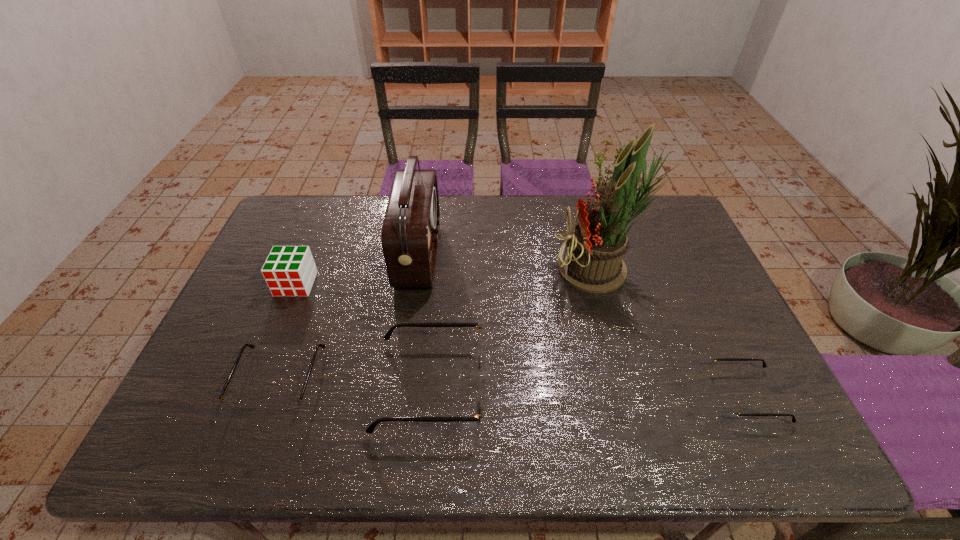
In order to click on vacant region located 0.090m at the hinge ends of the third shortest object in this screenshot , I will do `click(524, 386)`.

Where is `vacant area situated 0.260m at the hinge ends of the shortest spectacles`? The width and height of the screenshot is (960, 540). vacant area situated 0.260m at the hinge ends of the shortest spectacles is located at coordinates (604, 395).

At what (x,y) coordinates should I click in order to perform the action: click on vacant space located at the hinge ends of the shortest spectacles. Please return your answer as a coordinate pair (x, y). The height and width of the screenshot is (540, 960). Looking at the image, I should click on (672, 395).

Where is `vacant space located 0.210m at the hinge ends of the shortest spectacles`? The height and width of the screenshot is (540, 960). vacant space located 0.210m at the hinge ends of the shortest spectacles is located at coordinates (625, 395).

This screenshot has height=540, width=960. I want to click on blank area located 0.100m in front of the tallest object with the fan visible, so click(x=519, y=270).

At what (x,y) coordinates should I click in order to perform the action: click on vacant point located 0.100m in front of the tallest object with the fan visible. Please return your answer as a coordinate pair (x, y). The height and width of the screenshot is (540, 960). Looking at the image, I should click on (519, 270).

Find the location of a particular element. This screenshot has width=960, height=540. vacant area situated 0.150m in front of the tallest object with the fan visible is located at coordinates (503, 270).

Locate an element on the screen. This screenshot has height=540, width=960. free space located on the front panel of the radio receiver is located at coordinates (473, 255).

The image size is (960, 540). In order to click on vacant space located 0.290m on the red face of the cube in this screenshot , I will do `click(254, 386)`.

You are a GUI agent. You are given a task and a screenshot of the screen. Output one action in this format:
    pyautogui.click(x=<x>, y=<y>)
    Task: Click on the object situated at the far edge
    This screenshot has height=540, width=960.
    Given the screenshot: What is the action you would take?
    pyautogui.click(x=410, y=232)